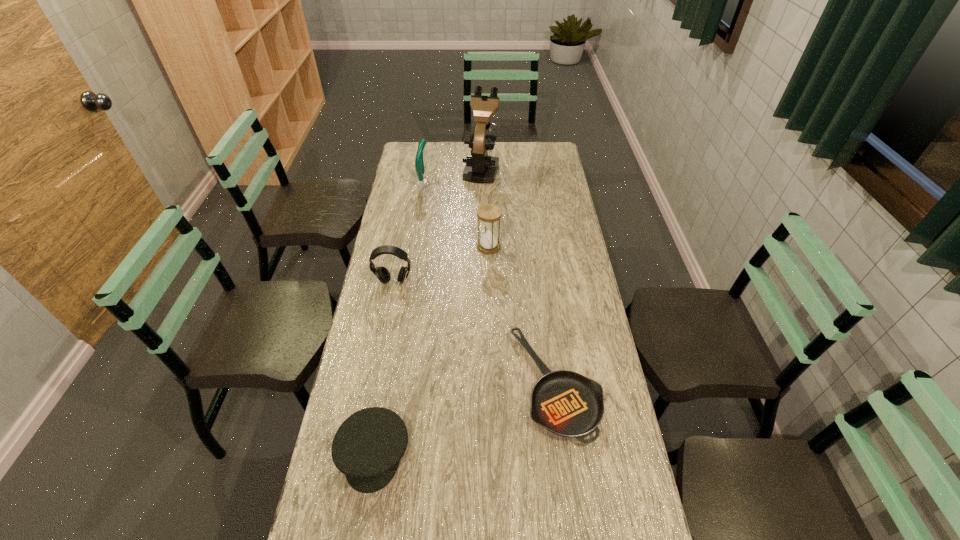
Where is `microscope`? The width and height of the screenshot is (960, 540). microscope is located at coordinates (481, 168).

At what (x,y) coordinates should I click in order to perform the action: click on the second tallest object. Please return your answer as a coordinate pair (x, y). Looking at the image, I should click on (419, 163).

You are a GUI agent. You are given a task and a screenshot of the screen. Output one action in this format:
    pyautogui.click(x=<x>, y=<y>)
    Task: Click on the fourth nearest object
    The width and height of the screenshot is (960, 540).
    Given the screenshot: What is the action you would take?
    click(x=489, y=214)

I want to click on earphone, so tap(383, 275).

Find the location of `beret`. beret is located at coordinates (367, 447).

This screenshot has width=960, height=540. In order to click on frying pan in this screenshot , I will do `click(568, 404)`.

This screenshot has height=540, width=960. In order to click on the shortest object in this screenshot , I will do `click(568, 404)`.

Where is `free location located on the left of the microscope`? The width and height of the screenshot is (960, 540). free location located on the left of the microscope is located at coordinates (441, 169).

Locate an element on the screen. This screenshot has height=540, width=960. vacant space located 0.370m at the jaws of the bottle opener is located at coordinates (509, 185).

The width and height of the screenshot is (960, 540). I want to click on free space located 0.200m on the back of the fourth nearest object, so click(488, 210).